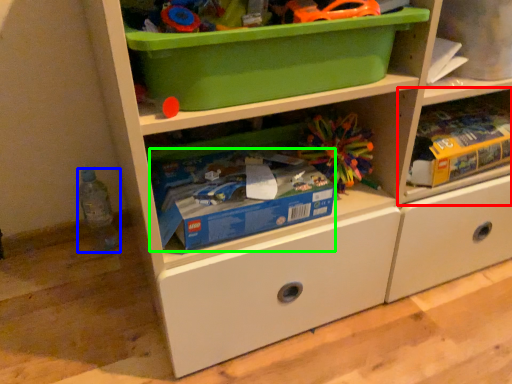
Question: Considering the real-world distances, which object is closest to shelf (highlighted by a red box)? bottle (highlighted by a blue box) or storage box (highlighted by a green box).

Choices:
 (A) bottle
 (B) storage box

Answer: (B)